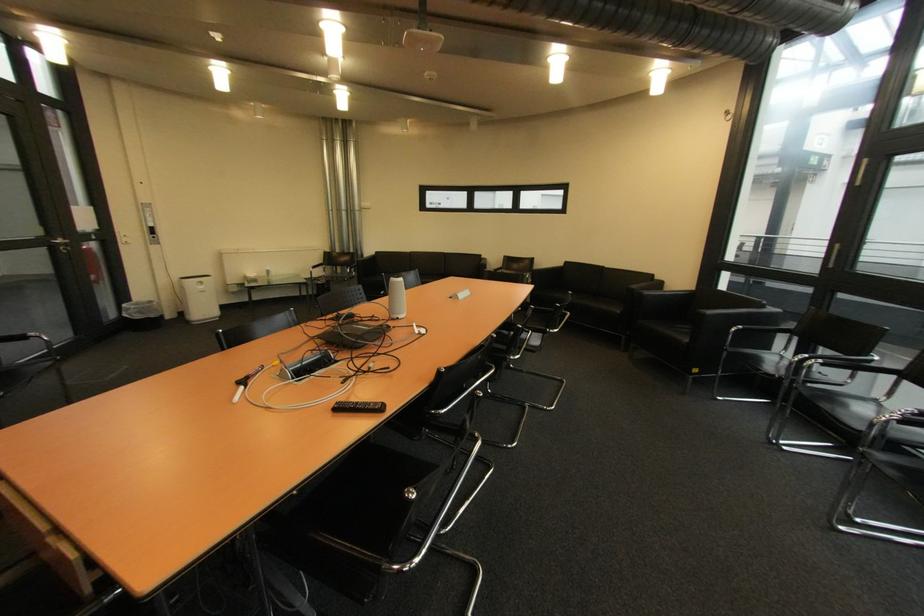
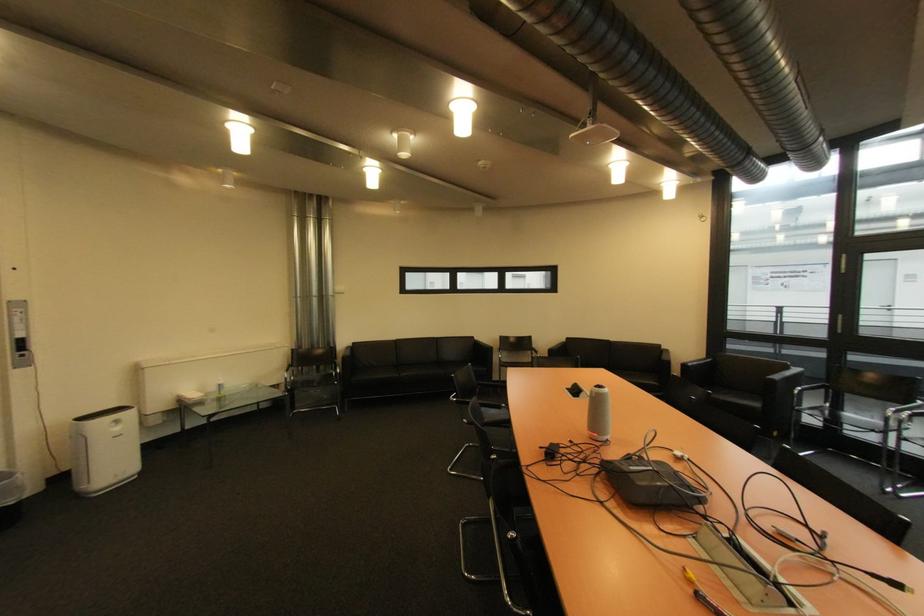
Locate, in the second image, the point that corresponds to [748,329] in the first image.

(808, 390)